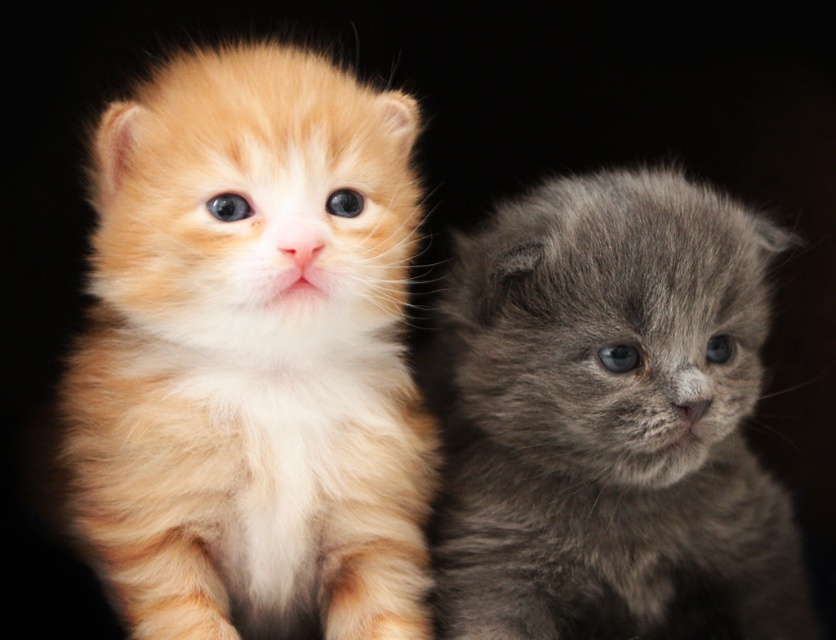
You are a cat owner trying to decide which kitten to adopt. Both kittens are in the image. The fluffy orange kitten at center and the gray fluffy kitten at right. Based on their sizes, which one might require more space in your home?

The fluffy orange kitten at center is larger in size than the gray fluffy kitten at right, so it would require more space in your home.

You are holding a small toy that is 0.5 meters long. You want to place it so that it reaches from the camera to the point at point (x=84, y=422). Will the toy be long enough?

The distance of point (x=84, y=422) from the camera is 1.23 meters. The toy is only 0.5 meters long, which is shorter than the required distance. Therefore, the toy will not be long enough to reach the point.